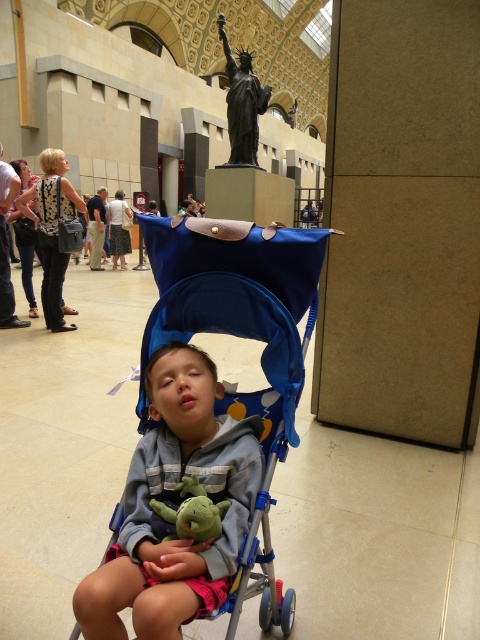
Based on the photo, you are a parent in the museum with your child. You notice the blue fabric baby carriage at center and the green plush toy at center. Which object is closer to you?

The blue fabric baby carriage at center is closer to you because it is positioned over the green plush toy at center, indicating it is in front.

You are a parent who just noticed your child left a toy in the stroller. You need to retrieve it without disturbing the child. Which object should you check first, the blue fabric baby carriage at center or the green plush toy at center?

The blue fabric baby carriage at center has a larger size compared to the green plush toy at center, so you should check the blue fabric baby carriage at center first as it is bigger and more likely to hold the toy.

You are a security guard in the museum and need to locate the gray fleece jacket at center for a lost item report. According to the coordinates provided, where exactly is the jacket positioned in the image?

The gray fleece jacket at center is located at point (175, 506), which means it is positioned towards the lower right quadrant of the image based on standard coordinate systems where the origin is the top left corner.